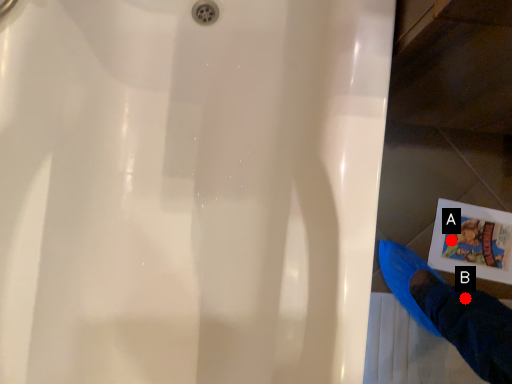
Question: Two points are circled on the image, labeled by A and B beside each circle. Which of the following is the closest to the observer?

Choices:
 (A) A is closer
 (B) B is closer

Answer: (B)